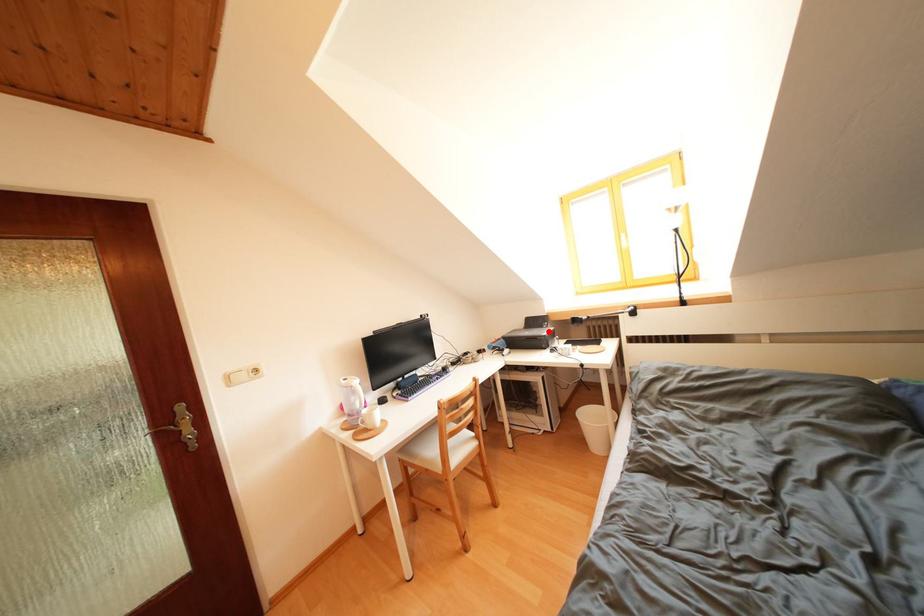
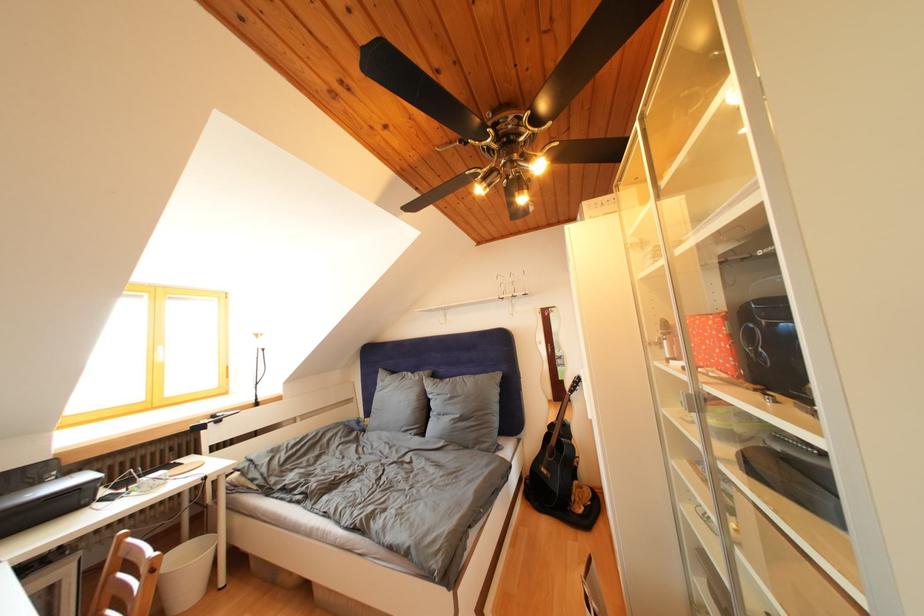
Find the pixel in the second image that matches the highlighted location in the first image.

(44, 488)